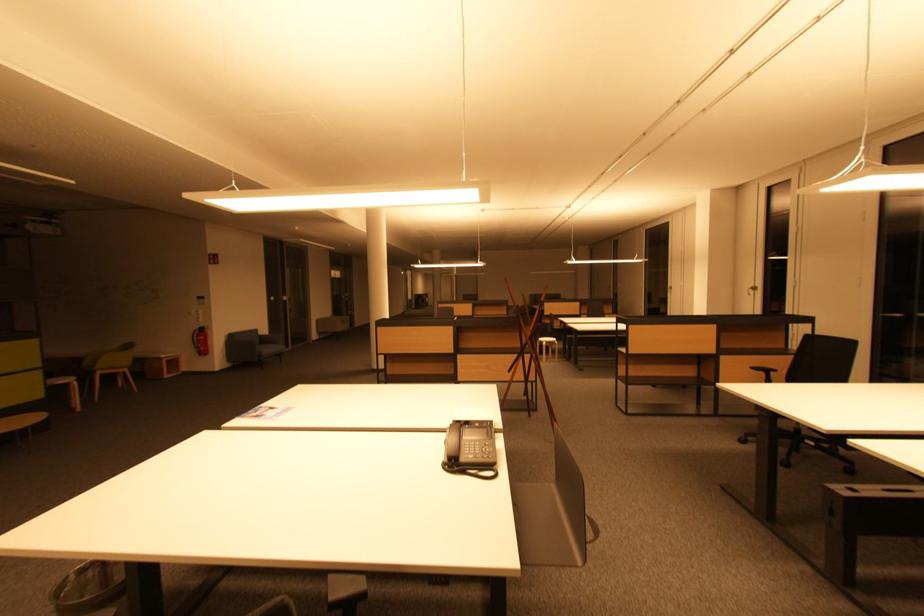
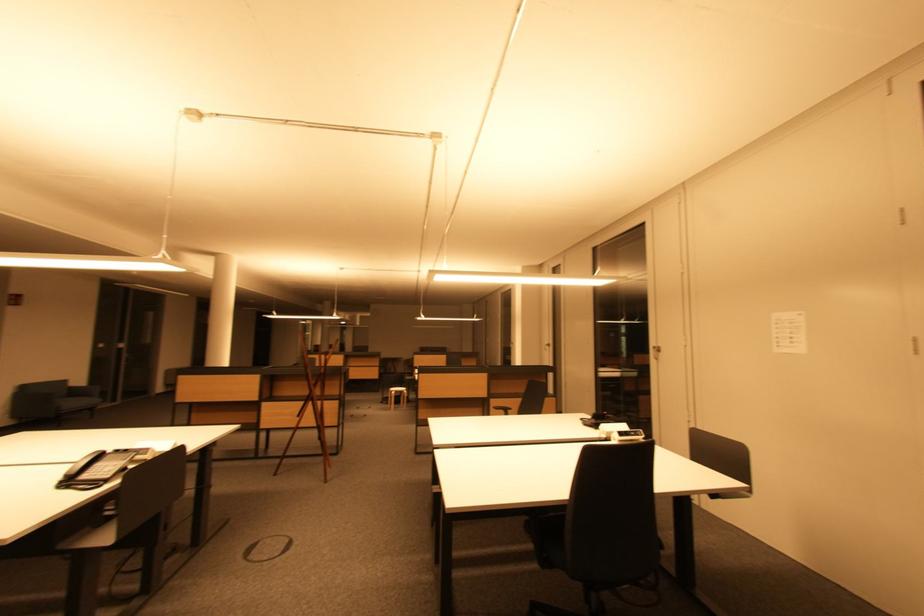
The images are taken continuously from a first-person perspective. In which direction are you moving?

The cameraman moved toward right, backward.